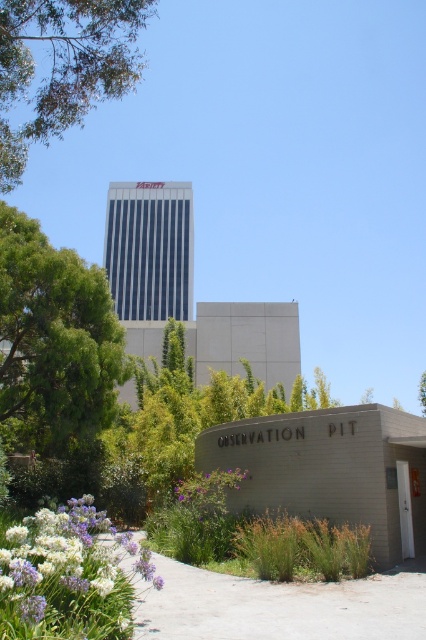
You are standing in the observation pit and want to take a photo of the skyscraper. To avoid blocking the view, which object should you move away from? Please choose between the green leafy tree at left and the white matte flowers at lower left.

The green leafy tree at left is taller than the white matte flowers at lower left, so you should move away from the green leafy tree at left to avoid blocking the view of the skyscraper.

You are standing in the observation pit and want to take a photo of the green leafy tree at upper center. If your camera has a maximum focus range of 8 meters, will it be able to capture the tree clearly?

The green leafy tree at upper center is 8.25 meters away from the viewer. Since the camera can only focus up to 8 meters, it won not be able to capture the tree clearly.